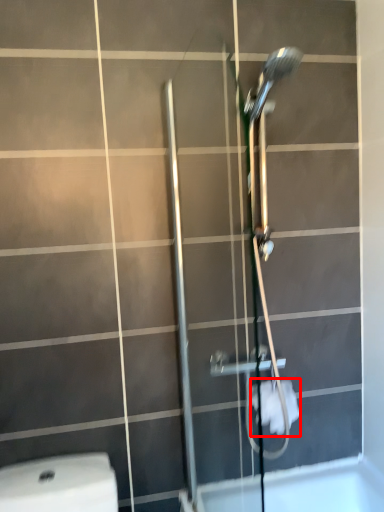
Question: From the image's perspective, what is the correct spatial positioning of toilet paper (annotated by the red box) in reference to shower door?

Choices:
 (A) below
 (B) above

Answer: (A)